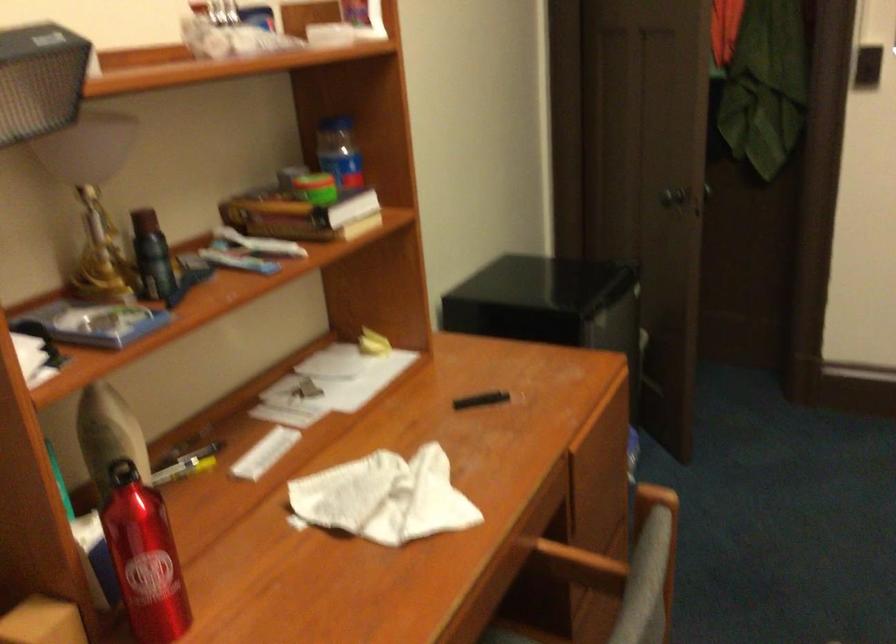
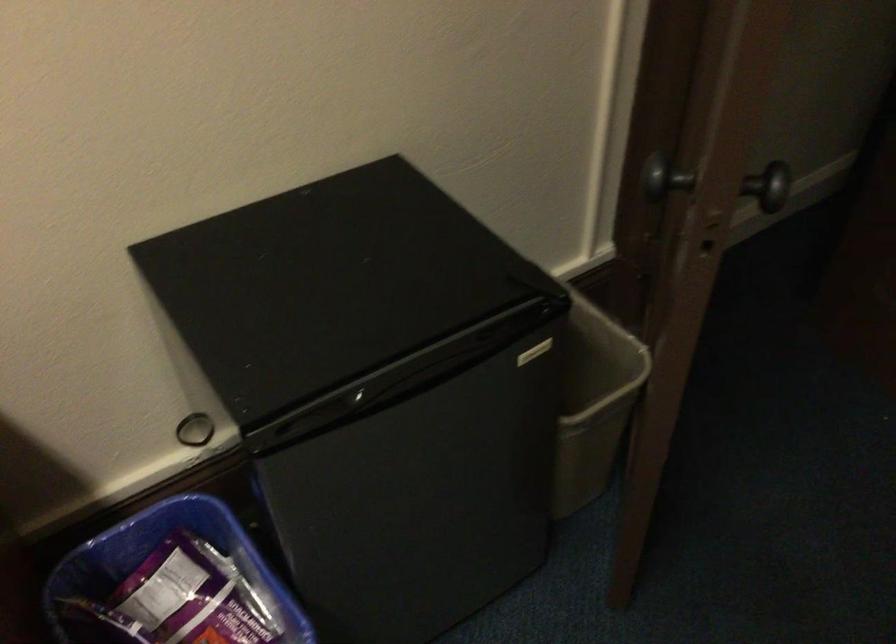
In the second image, find the point that corresponds to the point at 673,190 in the first image.

(656, 174)